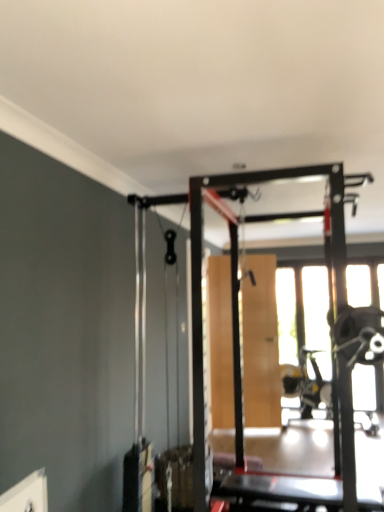
What is the approximate width of transparent glass window at center?

It is 3.54 inches.

The image size is (384, 512). I want to click on transparent glass window at center, so click(x=317, y=315).

The image size is (384, 512). What do you see at coordinates (317, 315) in the screenshot? I see `transparent glass window at center` at bounding box center [317, 315].

What do you see at coordinates (261, 345) in the screenshot? This screenshot has height=512, width=384. I see `wooden screen door at center` at bounding box center [261, 345].

Find the location of a particular element. The width and height of the screenshot is (384, 512). wooden screen door at center is located at coordinates (261, 345).

In order to face wooden screen door at center, should I rotate leftwards or rightwards?

Rotate right and turn 7.058 degrees.

Locate an element on the screen. This screenshot has height=512, width=384. transparent glass window at center is located at coordinates (317, 315).

Considering the positions of objects transparent glass window at center and wooden screen door at center in the image provided, who is more to the right, transparent glass window at center or wooden screen door at center?

transparent glass window at center is more to the right.

Which object is further away from the camera taking this photo, transparent glass window at center or wooden screen door at center?

transparent glass window at center.

Which is farther from the camera, (x=357, y=388) or (x=269, y=381)?

Point (x=269, y=381)

From the image's perspective, is transparent glass window at center over wooden screen door at center?

No.

From a real-world perspective, is transparent glass window at center positioned above or below wooden screen door at center?

From a real-world perspective, transparent glass window at center is physically above wooden screen door at center.

Between transparent glass window at center and wooden screen door at center, which one has larger width?

wooden screen door at center is wider.

Is transparent glass window at center taller than wooden screen door at center?

Correct, transparent glass window at center is much taller as wooden screen door at center.

Considering the relative sizes of transparent glass window at center and wooden screen door at center in the image provided, is transparent glass window at center smaller than wooden screen door at center?

Yes, transparent glass window at center is smaller than wooden screen door at center.

Would you say wooden screen door at center is part of transparent glass window at center's contents?

No, wooden screen door at center is not a part of transparent glass window at center.

Is there a large distance between transparent glass window at center and wooden screen door at center?

No, transparent glass window at center is not far away from wooden screen door at center.

Is transparent glass window at center positioned with its back to wooden screen door at center?

transparent glass window at center does not have its back to wooden screen door at center.

How different are the orientations of transparent glass window at center and wooden screen door at center in degrees?

There is a 15.4-degree angle between the facing directions of transparent glass window at center and wooden screen door at center.

At what (x,y) coordinates should I click in order to perform the action: click on window above the wooden screen door at center (from a real-world perspective). Please return your answer as a coordinate pair (x, y). This screenshot has width=384, height=512. Looking at the image, I should click on (317, 315).

Is wooden screen door at center at the left side of transparent glass window at center?

Yes.

Between wooden screen door at center and transparent glass window at center, which one is positioned behind?

transparent glass window at center is more distant.

Is point (271, 327) more distant than point (362, 409)?

Yes.

From the image's perspective, is wooden screen door at center under transparent glass window at center?

Incorrect, from the image's perspective, wooden screen door at center is higher than transparent glass window at center.

From a real-world perspective, which object rests below the other?

wooden screen door at center.

Looking at this image, is wooden screen door at center wider than transparent glass window at center?

Yes, wooden screen door at center is wider than transparent glass window at center.

Between wooden screen door at center and transparent glass window at center, which one has more height?

With more height is transparent glass window at center.

Who is bigger, wooden screen door at center or transparent glass window at center?

With larger size is wooden screen door at center.

Based on the photo, choose the correct answer: Is wooden screen door at center inside transparent glass window at center or outside it?

wooden screen door at center is not enclosed by transparent glass window at center.

Is wooden screen door at center positioned far away from transparent glass window at center?

No, wooden screen door at center is in close proximity to transparent glass window at center.

Could you tell me if wooden screen door at center is turned towards transparent glass window at center?

→ No.

What are the coordinates of `screen door that is under the transparent glass window at center (from a real-world perspective)` in the screenshot? It's located at (261, 345).

Identify the location of window above the wooden screen door at center (from a real-world perspective). This screenshot has width=384, height=512. (317, 315).

You are a GUI agent. You are given a task and a screenshot of the screen. Output one action in this format:
    pyautogui.click(x=<x>, y=<y>)
    Task: Click on the screen door below the transparent glass window at center (from a real-world perspective)
    The height and width of the screenshot is (512, 384).
    Given the screenshot: What is the action you would take?
    pyautogui.click(x=261, y=345)